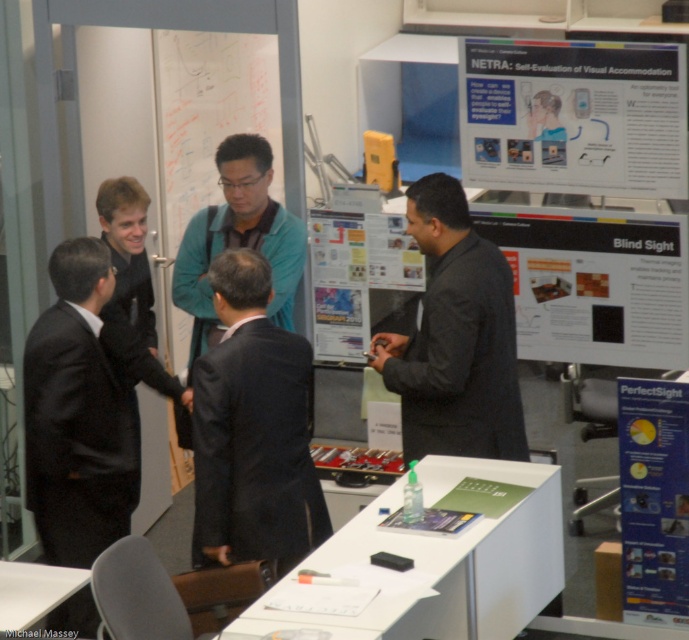
You are organizing a presentation and need to place two white papers on the table. The white paper at upper right and the white paper at lower right are both available. Which one should you choose if you need a larger surface area for notes?

The white paper at upper right is larger in size than the white paper at lower right, so you should choose the white paper at upper right for a larger surface area.

You are organizing a conference and need to place a name tag on the table. The name tag is 10 cm wide. The white paper at upper right and white paper at lower right are both on the table. Which paper can you place the name tag on without overlapping?

The white paper at upper right is positioned over white paper at lower right, so placing the name tag on the upper right paper would avoid overlapping with the lower one. However, since both papers are white, ensure there is enough space on the upper paper to fit the 10 cm name tag without overlapping edges.

You are an attendee at this conference. You want to take a photo of the white paper poster at center and the teal fabric shirt at center. Which one should you zoom in more on to capture details clearly?

You should zoom in more on the white paper poster at center because it has a smaller size compared to the teal fabric shirt at center, making it harder to capture details without magnification.